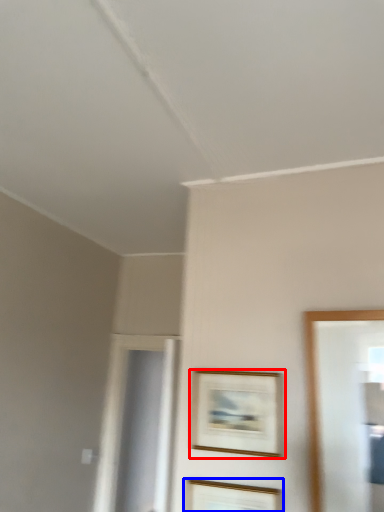
Question: Which object appears farthest to the camera in this image, picture frame (highlighted by a red box) or picture frame (highlighted by a blue box)?

Choices:
 (A) picture frame
 (B) picture frame

Answer: (A)